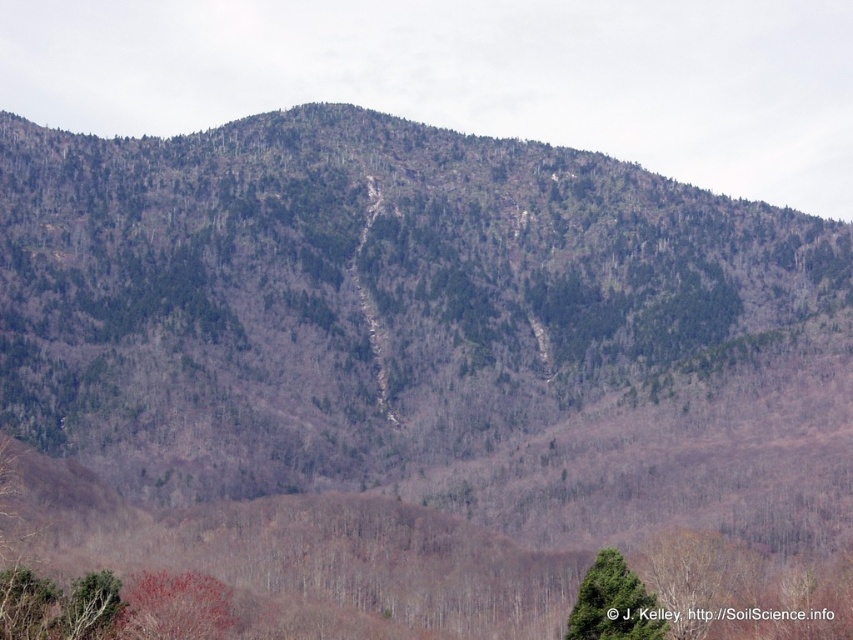
Question: Which point is farther to the camera?

Choices:
 (A) [x=169, y=625]
 (B) [x=585, y=572]

Answer: (B)

Question: Where is smooth reddish-brown tree at lower left located in relation to green matte tree at lower right in the image?

Choices:
 (A) above
 (B) below

Answer: (B)

Question: Observing the image, what is the correct spatial positioning of smooth reddish-brown tree at lower left in reference to green matte tree at lower right?

Choices:
 (A) above
 (B) below

Answer: (B)

Question: Among these objects, which one is farthest from the camera?

Choices:
 (A) green matte tree at lower right
 (B) smooth reddish-brown tree at lower left

Answer: (B)

Question: Among these objects, which one is nearest to the camera?

Choices:
 (A) smooth reddish-brown tree at lower left
 (B) green matte tree at lower right

Answer: (B)

Question: Is smooth reddish-brown tree at lower left further to the viewer compared to green matte tree at lower right?

Choices:
 (A) yes
 (B) no

Answer: (A)